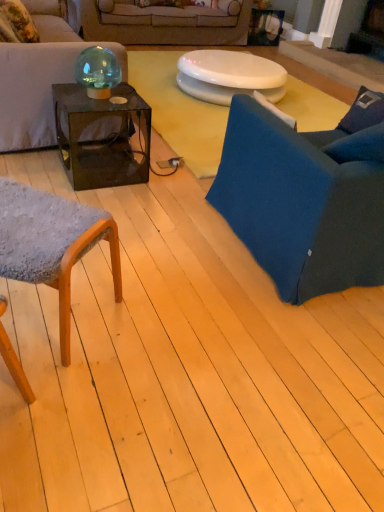
How much space does matte black couch at upper left, placed as the first studio couch when sorted from front to back, occupy horizontally?

The width of matte black couch at upper left, placed as the first studio couch when sorted from front to back, is 35.78 inches.

Describe the element at coordinates (97, 71) in the screenshot. I see `teal glass sphere at upper left` at that location.

Find the location of `textured gray fabric chair at lower left, which is the 1th chair from left to right`. textured gray fabric chair at lower left, which is the 1th chair from left to right is located at coordinates (51, 243).

This screenshot has width=384, height=512. What do you see at coordinates (160, 23) in the screenshot?
I see `beige fabric couch at upper center, arranged as the first studio couch when viewed from the back` at bounding box center [160, 23].

What do you see at coordinates (306, 197) in the screenshot? I see `blue fabric chair at right, which is the second chair from left to right` at bounding box center [306, 197].

I want to click on blue fabric chair at right, the first chair positioned from the right, so click(x=306, y=197).

Image resolution: width=384 pixels, height=512 pixels. I want to click on white glossy toilet seat at center, so click(x=229, y=76).

Image resolution: width=384 pixels, height=512 pixels. Find the location of `matte black couch at upper left, placed as the first studio couch when sorted from front to back`. matte black couch at upper left, placed as the first studio couch when sorted from front to back is located at coordinates (40, 77).

Consider the image. Is fluffy fabric pillow at upper left beside blue fabric chair at right, which is the second chair from left to right?

No.

Relative to blue fabric chair at right, which is the second chair from left to right, is fluffy fabric pillow at upper left in front or behind?

fluffy fabric pillow at upper left is positioned farther from the viewer than blue fabric chair at right, which is the second chair from left to right.

From a real-world perspective, is fluffy fabric pillow at upper left beneath blue fabric chair at right, which is the second chair from left to right?

No, from a real-world perspective, fluffy fabric pillow at upper left is not under blue fabric chair at right, which is the second chair from left to right.

Which is in front, point (3, 21) or point (345, 245)?

Point (345, 245)

Which is more to the left, beige fabric couch at upper center, arranged as the first studio couch when viewed from the back, or matte black couch at upper left, placed as the first studio couch when sorted from front to back?

Positioned to the left is matte black couch at upper left, placed as the first studio couch when sorted from front to back.

From a real-world perspective, is beige fabric couch at upper center, positioned as the 2th studio couch in front-to-back order, over matte black couch at upper left, positioned as the second studio couch in back-to-front order?

No.

Would you say beige fabric couch at upper center, arranged as the first studio couch when viewed from the back, is inside or outside matte black couch at upper left, placed as the first studio couch when sorted from front to back?

beige fabric couch at upper center, arranged as the first studio couch when viewed from the back, exists outside the volume of matte black couch at upper left, placed as the first studio couch when sorted from front to back.

From the image's perspective, is beige fabric couch at upper center, arranged as the first studio couch when viewed from the back, under matte black couch at upper left, placed as the first studio couch when sorted from front to back?

Incorrect, from the image's perspective, beige fabric couch at upper center, arranged as the first studio couch when viewed from the back, is higher than matte black couch at upper left, placed as the first studio couch when sorted from front to back.

You are a GUI agent. You are given a task and a screenshot of the screen. Output one action in this format:
    pyautogui.click(x=<x>, y=<y>)
    Task: Click on the coffee table below the beige fabric couch at upper center, arranged as the first studio couch when viewed from the back (from the image's perspective)
    
    Given the screenshot: What is the action you would take?
    pyautogui.click(x=100, y=140)

Does beige fabric couch at upper center, arranged as the first studio couch when viewed from the back, have a lesser width compared to transparent glass cube at center?

In fact, beige fabric couch at upper center, arranged as the first studio couch when viewed from the back, might be wider than transparent glass cube at center.

What's the angular difference between beige fabric couch at upper center, positioned as the 2th studio couch in front-to-back order, and transparent glass cube at center's facing directions?

91.8 degrees separate the facing orientations of beige fabric couch at upper center, positioned as the 2th studio couch in front-to-back order, and transparent glass cube at center.

Can we say beige fabric couch at upper center, arranged as the first studio couch when viewed from the back, lies outside transparent glass cube at center?

Yes, beige fabric couch at upper center, arranged as the first studio couch when viewed from the back, is not within transparent glass cube at center.

Is matte black couch at upper left, placed as the first studio couch when sorted from front to back, aimed at white glossy toilet seat at center?

Yes, matte black couch at upper left, placed as the first studio couch when sorted from front to back, is oriented towards white glossy toilet seat at center.

From the image's perspective, is matte black couch at upper left, positioned as the second studio couch in back-to-front order, above or below white glossy toilet seat at center?

matte black couch at upper left, positioned as the second studio couch in back-to-front order, is above white glossy toilet seat at center.

The image size is (384, 512). Find the location of `table below the matte black couch at upper left, positioned as the second studio couch in back-to-front order (from a real-world perspective)`. table below the matte black couch at upper left, positioned as the second studio couch in back-to-front order (from a real-world perspective) is located at coordinates (229, 76).

Considering the relative positions of matte black couch at upper left, positioned as the second studio couch in back-to-front order, and white glossy toilet seat at center in the image provided, is matte black couch at upper left, positioned as the second studio couch in back-to-front order, to the left or to the right of white glossy toilet seat at center?

Clearly, matte black couch at upper left, positioned as the second studio couch in back-to-front order, is on the left of white glossy toilet seat at center in the image.

This screenshot has width=384, height=512. Find the location of `coffee table in front of the white glossy toilet seat at center`. coffee table in front of the white glossy toilet seat at center is located at coordinates (100, 140).

Is transparent glass cube at center at the right side of white glossy toilet seat at center?

No, transparent glass cube at center is not to the right of white glossy toilet seat at center.

Is the depth of transparent glass cube at center less than that of white glossy toilet seat at center?

Yes, transparent glass cube at center is closer to the camera.

Looking at their sizes, would you say transparent glass cube at center is wider or thinner than white glossy toilet seat at center?

In the image, transparent glass cube at center appears to be more narrow than white glossy toilet seat at center.

Measure the distance between white glossy toilet seat at center and fluffy fabric pillow at upper left.

white glossy toilet seat at center is 5.81 feet from fluffy fabric pillow at upper left.

Which of these two, white glossy toilet seat at center or fluffy fabric pillow at upper left, is smaller?

fluffy fabric pillow at upper left is smaller.

Would you say white glossy toilet seat at center is inside or outside fluffy fabric pillow at upper left?

white glossy toilet seat at center is spatially situated outside fluffy fabric pillow at upper left.

Considering the relative positions of white glossy toilet seat at center and fluffy fabric pillow at upper left in the image provided, is white glossy toilet seat at center to the left of fluffy fabric pillow at upper left from the viewer's perspective?

No, white glossy toilet seat at center is not to the left of fluffy fabric pillow at upper left.

Which of these two, white glossy toilet seat at center or textured gray fabric chair at lower left, which is the 1th chair from left to right, is thinner?

With smaller width is textured gray fabric chair at lower left, which is the 1th chair from left to right.

The image size is (384, 512). In order to click on table lying on the right of textured gray fabric chair at lower left, which is the second chair in right-to-left order in this screenshot , I will do `click(229, 76)`.

Between white glossy toilet seat at center and textured gray fabric chair at lower left, which is the 1th chair from left to right, which one has more height?

Standing taller between the two is textured gray fabric chair at lower left, which is the 1th chair from left to right.

Locate an element on the screen. This screenshot has height=512, width=384. pillow that appears above the blue fabric chair at right, which is the second chair from left to right (from the image's perspective) is located at coordinates (16, 23).

Where is `studio couch that appears behind the matte black couch at upper left, placed as the first studio couch when sorted from front to back`? The image size is (384, 512). studio couch that appears behind the matte black couch at upper left, placed as the first studio couch when sorted from front to back is located at coordinates (160, 23).

Estimate the real-world distances between objects in this image. Which object is further from beige fabric couch at upper center, arranged as the first studio couch when viewed from the back, textured gray fabric chair at lower left, which is the 1th chair from left to right, or fluffy fabric pillow at upper left?

textured gray fabric chair at lower left, which is the 1th chair from left to right, is further to beige fabric couch at upper center, arranged as the first studio couch when viewed from the back.

Which object lies nearer to the anchor point teal glass sphere at upper left, transparent glass cube at center or beige fabric couch at upper center, positioned as the 2th studio couch in front-to-back order?

transparent glass cube at center lies closer to teal glass sphere at upper left than the other object.

Based on their spatial positions, is teal glass sphere at upper left or blue fabric chair at right, the first chair positioned from the right, closer to transparent glass cube at center?

Among the two, teal glass sphere at upper left is located nearer to transparent glass cube at center.

Estimate the real-world distances between objects in this image. Which object is further from matte black couch at upper left, positioned as the second studio couch in back-to-front order, teal glass sphere at upper left or beige fabric couch at upper center, arranged as the first studio couch when viewed from the back?

The object further to matte black couch at upper left, positioned as the second studio couch in back-to-front order, is beige fabric couch at upper center, arranged as the first studio couch when viewed from the back.

When comparing their distances from textured gray fabric chair at lower left, which is the second chair in right-to-left order, does transparent glass cube at center or beige fabric couch at upper center, arranged as the first studio couch when viewed from the back, seem closer?

transparent glass cube at center.

From the image, which object appears to be nearer to textured gray fabric chair at lower left, which is the second chair in right-to-left order, matte black couch at upper left, placed as the first studio couch when sorted from front to back, or blue fabric chair at right, which is the second chair from left to right?

blue fabric chair at right, which is the second chair from left to right, is positioned closer to the anchor textured gray fabric chair at lower left, which is the second chair in right-to-left order.

Considering their positions, is teal glass sphere at upper left positioned further to textured gray fabric chair at lower left, which is the 1th chair from left to right, than fluffy fabric pillow at upper left?

The object further to textured gray fabric chair at lower left, which is the 1th chair from left to right, is fluffy fabric pillow at upper left.

Based on their spatial positions, is beige fabric couch at upper center, positioned as the 2th studio couch in front-to-back order, or teal glass sphere at upper left closer to blue fabric chair at right, which is the second chair from left to right?

teal glass sphere at upper left is closer to blue fabric chair at right, which is the second chair from left to right.

At what (x,y) coordinates should I click in order to perform the action: click on table between teal glass sphere at upper left and beige fabric couch at upper center, arranged as the first studio couch when viewed from the back, from front to back. Please return your answer as a coordinate pair (x, y). The image size is (384, 512). Looking at the image, I should click on (229, 76).

Where is `teal between matte black couch at upper left, positioned as the second studio couch in back-to-front order, and textured gray fabric chair at lower left, which is the 1th chair from left to right, from top to bottom`? teal between matte black couch at upper left, positioned as the second studio couch in back-to-front order, and textured gray fabric chair at lower left, which is the 1th chair from left to right, from top to bottom is located at coordinates (97, 71).

Identify the location of coffee table between blue fabric chair at right, which is the second chair from left to right, and beige fabric couch at upper center, arranged as the first studio couch when viewed from the back, along the z-axis. This screenshot has width=384, height=512. pos(100,140).

Where is `teal between fluffy fabric pillow at upper left and transparent glass cube at center in the up-down direction`? teal between fluffy fabric pillow at upper left and transparent glass cube at center in the up-down direction is located at coordinates (97, 71).